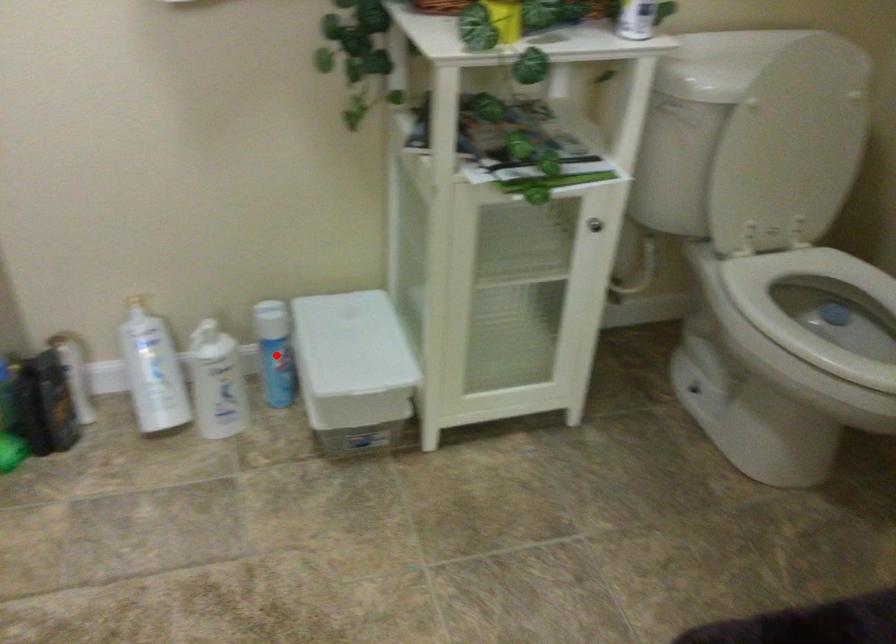
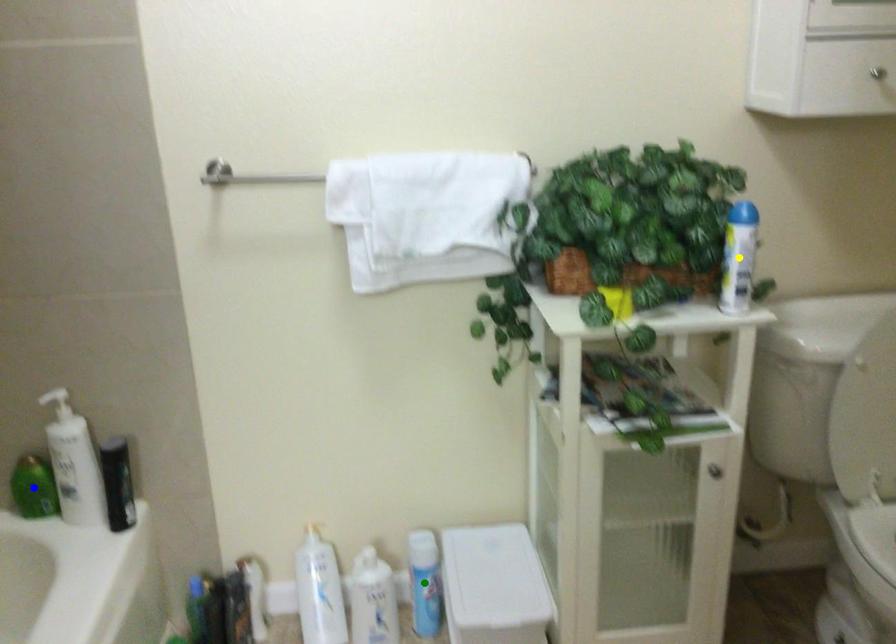
Question: I am providing you with two images of the same scene from different viewpoints. A red point is marked on the first image. You are given multiple points on the second image. In image 2, which mark is for the same physical point as the one in image 1?

Choices:
 (A) yellow point
 (B) green point
 (C) blue point

Answer: (B)